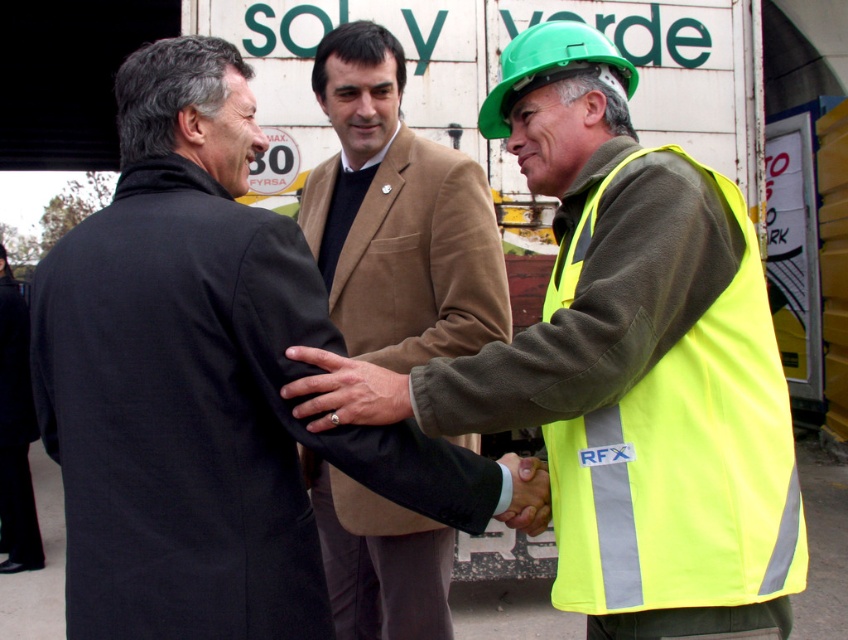
Question: Which of these objects is positioned closest to the neon yellow reflective vest at right?

Choices:
 (A) brown woolen suit at center
 (B) silver metallic ring at center
 (C) matte black hand at center
 (D) matte black coat at center

Answer: (C)

Question: Is matte black coat at center thinner than matte black hand at center?

Choices:
 (A) no
 (B) yes

Answer: (A)

Question: Estimate the real-world distances between objects in this image. Which object is farther from the silver metallic ring at center?

Choices:
 (A) neon yellow reflective vest at right
 (B) matte black hand at center
 (C) matte black coat at center
 (D) neon yellow safety vest at center

Answer: (A)

Question: Does neon yellow safety vest at center have a lesser width compared to silver metallic ring at center?

Choices:
 (A) yes
 (B) no

Answer: (B)

Question: Is the position of brown woolen suit at center more distant than that of silver metallic ring at center?

Choices:
 (A) yes
 (B) no

Answer: (A)

Question: Which object is farther from the camera taking this photo?

Choices:
 (A) matte black hand at center
 (B) neon yellow reflective vest at right

Answer: (A)